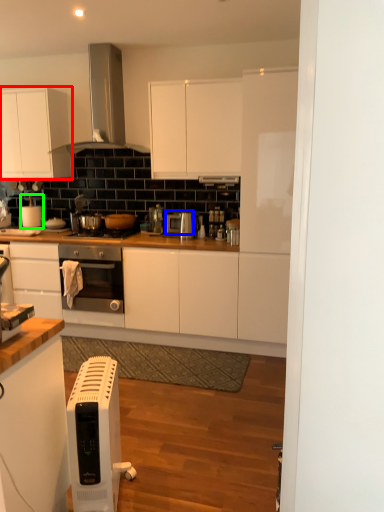
Question: Based on their relative distances, which object is nearer to cabinetry (highlighted by a red box)? Choose from appliance (highlighted by a blue box) and appliance (highlighted by a green box).

Choices:
 (A) appliance
 (B) appliance

Answer: (B)